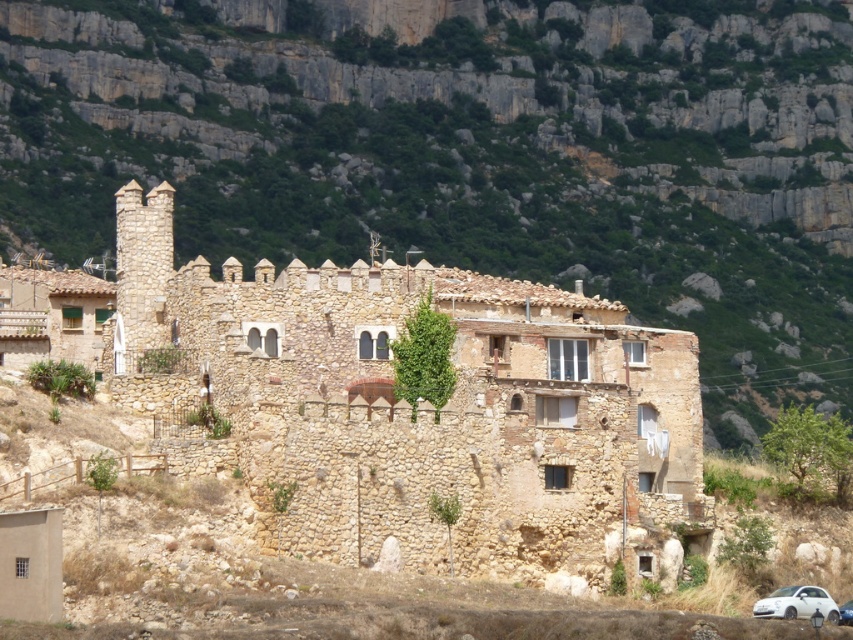
You are a hiker standing at the base of the gray rocky mountain at upper center and want to reach the white matte car at lower right. Which direction should you move to get closer to the car?

You should move away from the gray rocky mountain at upper center towards the lower right direction to get closer to the white matte car at lower right, since the mountain is further away from you compared to the car.

You are a photographer planning to take a landscape photo of the brown stone fort at center and the white matte car at lower right. You want to ensure both are visible in the frame. Based on their positions, which object should you focus on first to include both in the composition?

The brown stone fort at center is positioned over the white matte car at lower right, so focusing on the brown stone fort at center first will help include both in the composition.

You are a hiker who has just arrived at the base of the gray rocky mountain at upper center. You want to reach the summit. Based on the image, which direction should you head to start your climb?

The gray rocky mountain at upper center is located at point coordinates of (473,150). Since the hiker is at the base, they should head towards the upper center direction to reach the summit.